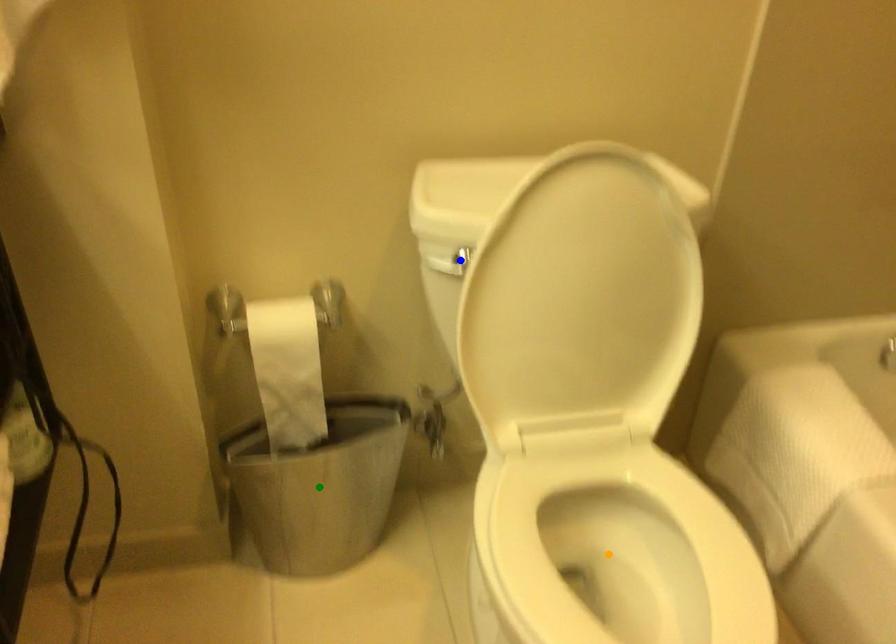
Order these from farthest to nearest:
blue point | green point | orange point

1. green point
2. orange point
3. blue point